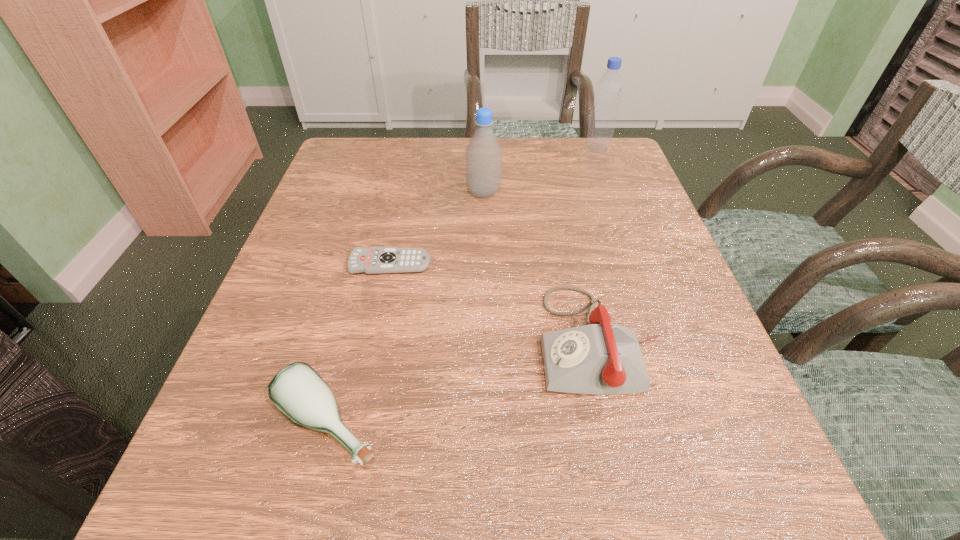
Find the location of a particular element. This screenshot has height=540, width=960. vacant space located 0.180m on the left of the third object from left to right is located at coordinates (389, 192).

Find the location of a particular element. This screenshot has width=960, height=540. vacant space situated on the dial of the telephone is located at coordinates (424, 340).

Identify the location of vacant region located on the dial of the telephone. (357, 340).

The image size is (960, 540). What are the coordinates of `vacant position located 0.150m on the dial of the telephone` in the screenshot? It's located at (448, 340).

I want to click on vacant space positioned on the back of the nearest bottle, so click(346, 353).

Find the location of a particular element. This screenshot has width=960, height=540. free location located 0.280m on the front of the third nearest object is located at coordinates (358, 414).

Find the location of a particular element. This screenshot has height=540, width=960. object that is at the near edge is located at coordinates (297, 390).

Find the location of a particular element. The height and width of the screenshot is (540, 960). bottle that is positioned at the left edge is located at coordinates (297, 390).

Identify the location of remote control that is at the left edge. This screenshot has height=540, width=960. (375, 260).

Where is `bottle at the right edge`? This screenshot has width=960, height=540. bottle at the right edge is located at coordinates (609, 88).